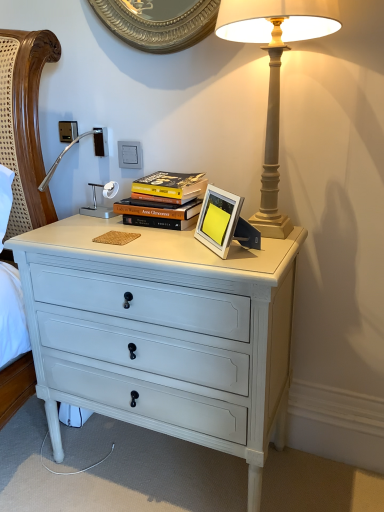
At what (x,y) coordinates should I click in order to perform the action: click on free space to the left of hardcover books at center. Please return your answer as a coordinate pair (x, y). The width and height of the screenshot is (384, 512). Looking at the image, I should click on tap(89, 223).